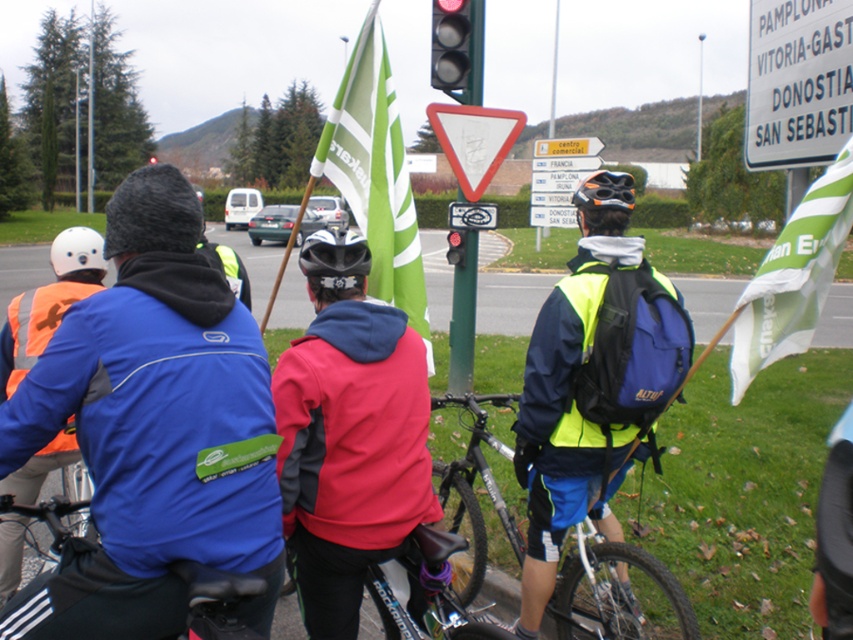
You are a pedestrian standing at the side of the road and see the red fabric jacket at center and the yellow plastic sign at center. Which object is taller when viewed from your perspective?

The yellow plastic sign at center is taller than the red fabric jacket at center.

You are a cyclist waiting at the traffic light. You notice a green striped flag at upper right and a red matte traffic light at center. Which object is bigger?

The green striped flag at upper right is larger in size than the red matte traffic light at center.

You are a cyclist waiting at the traffic light and you notice the silver metallic bicycle at center and the white plastic sign at upper right. Which object is closer to you?

The silver metallic bicycle at center is closer to you because it is in front of the white plastic sign at upper right.